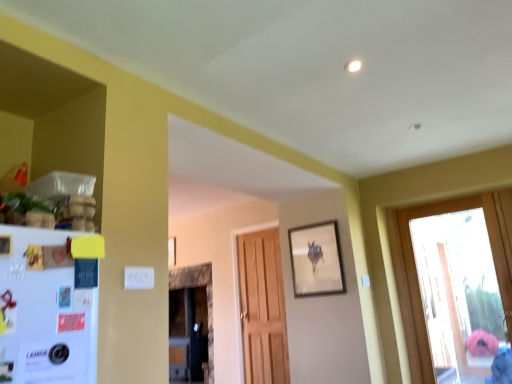
Question: Is transparent glass door at right outside of matte wooden picture frame at upper center, which appears as the 1th picture frame when viewed from the right?

Choices:
 (A) no
 (B) yes

Answer: (B)

Question: Is transparent glass door at right beside matte wooden picture frame at upper center, which appears as the 1th picture frame when viewed from the right?

Choices:
 (A) yes
 (B) no

Answer: (B)

Question: Considering the relative sizes of transparent glass door at right and matte wooden picture frame at upper center, which is the second picture frame from left to right, in the image provided, is transparent glass door at right taller than matte wooden picture frame at upper center, which is the second picture frame from left to right,?

Choices:
 (A) yes
 (B) no

Answer: (A)

Question: Is transparent glass door at right wider than matte wooden picture frame at upper center, which is the second picture frame from left to right?

Choices:
 (A) no
 (B) yes

Answer: (B)

Question: From a real-world perspective, is transparent glass door at right below matte wooden picture frame at upper center, the 2th picture frame viewed from the back?

Choices:
 (A) yes
 (B) no

Answer: (A)

Question: From the image's perspective, is matte wooden picture frame at center, which ranks as the 2th picture frame in front-to-back order, located above or below matte wooden picture frame at upper center, which is the second picture frame from left to right?

Choices:
 (A) above
 (B) below

Answer: (B)

Question: Is matte wooden picture frame at center, the second picture frame when ordered from right to left, taller or shorter than matte wooden picture frame at upper center, which is the 1th picture frame from front to back?

Choices:
 (A) short
 (B) tall

Answer: (A)

Question: Is matte wooden picture frame at center, placed as the first picture frame when sorted from left to right, bigger or smaller than matte wooden picture frame at upper center, the 2th picture frame viewed from the back?

Choices:
 (A) big
 (B) small

Answer: (B)

Question: Based on their positions, is matte wooden picture frame at center, placed as the first picture frame when sorted from left to right, located to the left or right of matte wooden picture frame at upper center, the 2th picture frame viewed from the back?

Choices:
 (A) left
 (B) right

Answer: (A)

Question: Is point (307, 235) positioned closer to the camera than point (458, 253)?

Choices:
 (A) farther
 (B) closer

Answer: (B)

Question: In terms of width, does matte wooden picture frame at upper center, which appears as the 1th picture frame when viewed from the right, look wider or thinner when compared to transparent glass door at right?

Choices:
 (A) wide
 (B) thin

Answer: (B)

Question: From the image's perspective, is matte wooden picture frame at upper center, which is the second picture frame from left to right, above or below transparent glass door at right?

Choices:
 (A) below
 (B) above

Answer: (B)

Question: From a real-world perspective, relative to transparent glass door at right, is matte wooden picture frame at upper center, which appears as the 1th picture frame when viewed from the right, vertically above or below?

Choices:
 (A) below
 (B) above

Answer: (B)

Question: From the image's perspective, is matte wooden picture frame at center, which ranks as the 2th picture frame in front-to-back order, located above or below white matte refrigerator at left?

Choices:
 (A) below
 (B) above

Answer: (A)

Question: Based on their positions, is matte wooden picture frame at center, the second picture frame when ordered from right to left, located to the left or right of white matte refrigerator at left?

Choices:
 (A) right
 (B) left

Answer: (B)